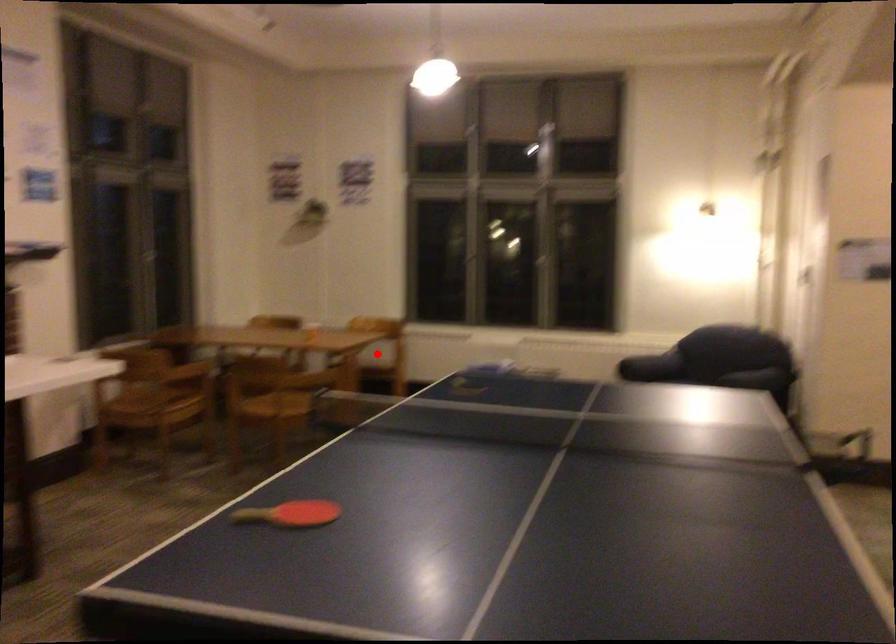
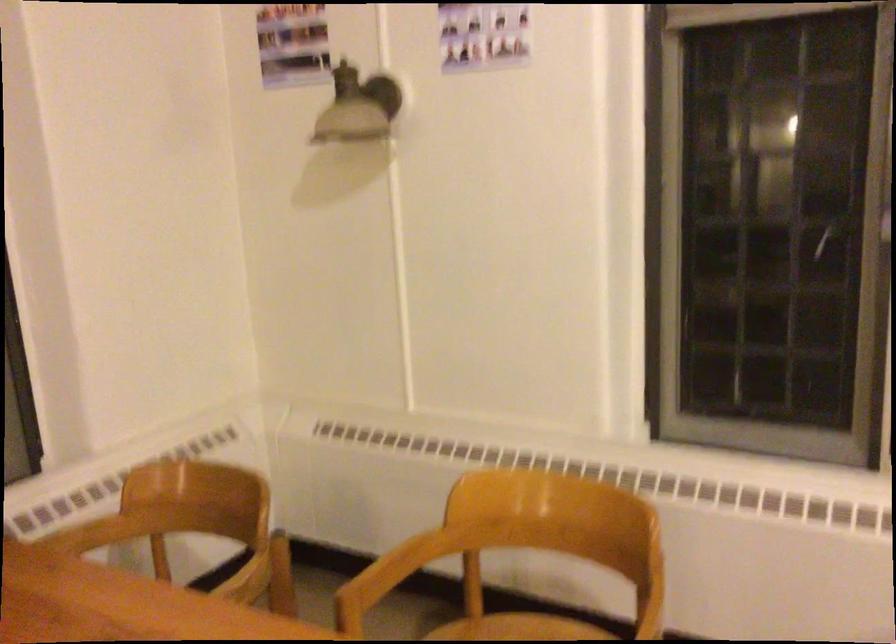
Question: I am providing you with two images of the same scene from different viewpoints. A red point is shown in image1. For the corresponding object point in image2, is it positioned nearer or farther from the camera?

Choices:
 (A) Nearer
 (B) Farther

Answer: (A)